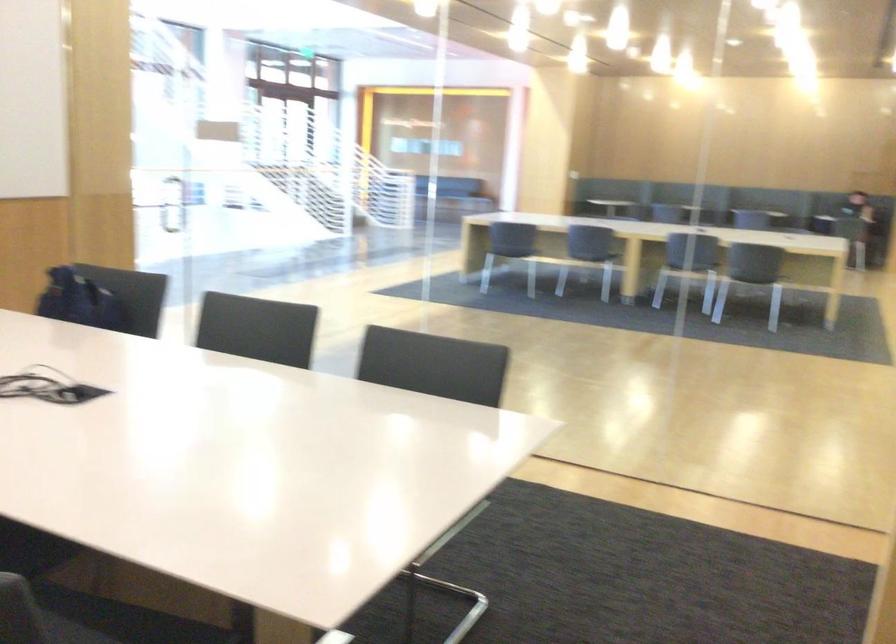
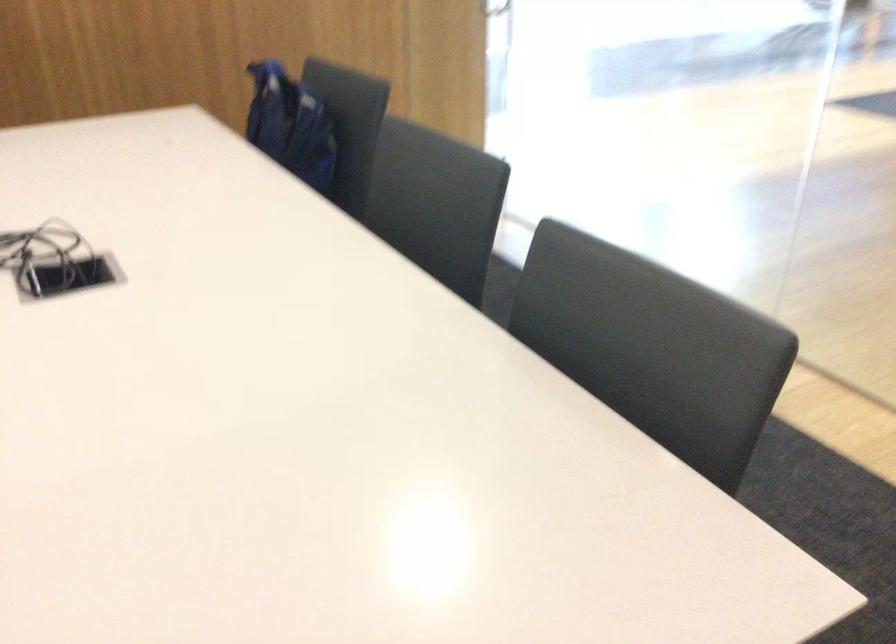
Find the pixel in the second image that matches (x=83, y=308) in the first image.

(289, 125)